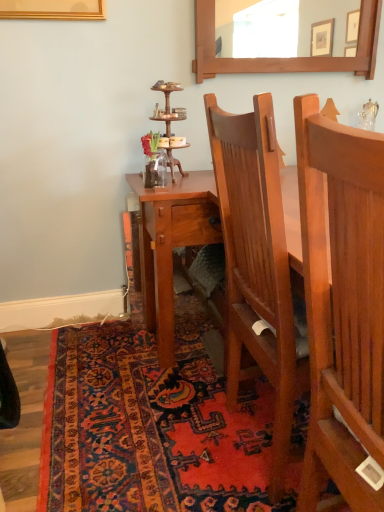
Question: In terms of width, does carpeted rug at lower center look wider or thinner when compared to wooden mirror at upper center?

Choices:
 (A) wide
 (B) thin

Answer: (A)

Question: Considering the positions of carpeted rug at lower center and wooden mirror at upper center in the image, is carpeted rug at lower center taller or shorter than wooden mirror at upper center?

Choices:
 (A) tall
 (B) short

Answer: (B)

Question: Estimate the real-world distances between objects in this image. Which object is closer to the wooden mirror at upper center?

Choices:
 (A) light brown wood chair at center
 (B) carpeted rug at lower center

Answer: (A)

Question: Which is farther from the carpeted rug at lower center?

Choices:
 (A) light brown wood chair at center
 (B) wooden mirror at upper center

Answer: (B)